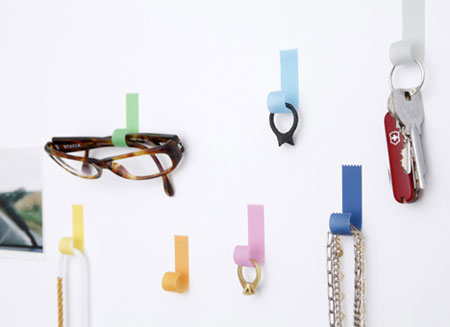
At what (x,y) coordinates should I click in order to perform the action: click on white hook. Please return your answer as a coordinate pair (x, y). The image size is (450, 327). Looking at the image, I should click on (414, 35).